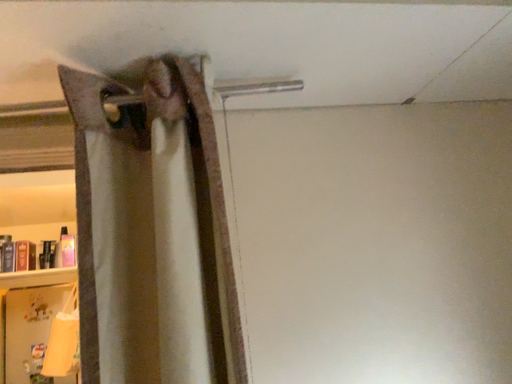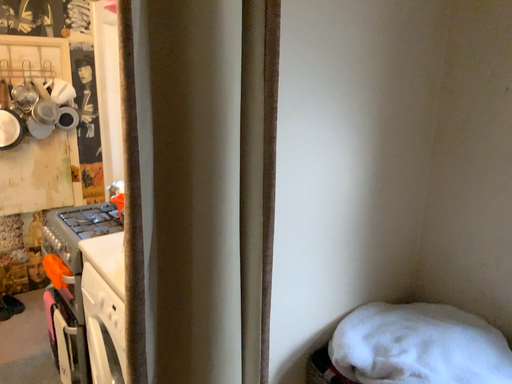
Question: Which way did the camera rotate in the video?

Choices:
 (A) rotated upward
 (B) rotated downward

Answer: (B)